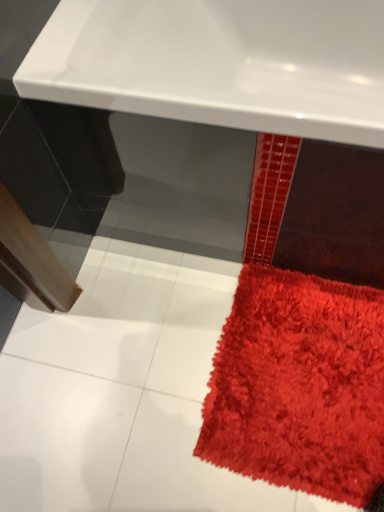
This screenshot has height=512, width=384. What do you see at coordinates (219, 63) in the screenshot? I see `white glossy sink at upper center` at bounding box center [219, 63].

In order to face white glossy sink at upper center, should I rotate leftwards or rightwards?

Rotate right and turn 7.686 degrees.

Where is `white glossy sink at upper center`? The height and width of the screenshot is (512, 384). white glossy sink at upper center is located at coordinates (219, 63).

In order to face shaggy red rug at lower right, should I rotate leftwards or rightwards?

Rotate right and turn 14.698 degrees.

Where is `shaggy red rug at lower right`? Image resolution: width=384 pixels, height=512 pixels. shaggy red rug at lower right is located at coordinates (299, 386).

What do you see at coordinates (299, 386) in the screenshot? I see `shaggy red rug at lower right` at bounding box center [299, 386].

Measure the distance between point (366, 502) and camera.

The depth of point (366, 502) is 36.57 inches.

The image size is (384, 512). I want to click on white glossy sink at upper center, so click(219, 63).

Is white glossy sink at upper center to the left or to the right of shaggy red rug at lower right in the image?

Clearly, white glossy sink at upper center is on the left of shaggy red rug at lower right in the image.

Does white glossy sink at upper center lie behind shaggy red rug at lower right?

No.

Does point (231, 32) lie behind point (227, 340)?

Yes, point (231, 32) is farther from viewer.

From the image's perspective, is white glossy sink at upper center beneath shaggy red rug at lower right?

No.

From a real-world perspective, is white glossy sink at upper center physically located above or below shaggy red rug at lower right?

white glossy sink at upper center is situated higher than shaggy red rug at lower right in the real world.

Considering the sizes of white glossy sink at upper center and shaggy red rug at lower right in the image, is white glossy sink at upper center wider or thinner than shaggy red rug at lower right?

Clearly, white glossy sink at upper center has more width compared to shaggy red rug at lower right.

Considering the relative sizes of white glossy sink at upper center and shaggy red rug at lower right in the image provided, is white glossy sink at upper center taller than shaggy red rug at lower right?

Yes, white glossy sink at upper center is taller than shaggy red rug at lower right.

Who is smaller, white glossy sink at upper center or shaggy red rug at lower right?

With smaller size is shaggy red rug at lower right.

Looking at this image, is shaggy red rug at lower right a part of white glossy sink at upper center?

No, shaggy red rug at lower right is not surrounded by white glossy sink at upper center.

Is white glossy sink at upper center in contact with shaggy red rug at lower right?

white glossy sink at upper center is not next to shaggy red rug at lower right, and they're not touching.

Is white glossy sink at upper center oriented away from shaggy red rug at lower right?

white glossy sink at upper center is not turned away from shaggy red rug at lower right.

How far apart are white glossy sink at upper center and shaggy red rug at lower right?

A distance of 63.16 centimeters exists between white glossy sink at upper center and shaggy red rug at lower right.

At what (x,y) coordinates should I click in order to perform the action: click on mat to the right of white glossy sink at upper center. Please return your answer as a coordinate pair (x, y). Looking at the image, I should click on (299, 386).

Considering the relative positions of shaggy red rug at lower right and white glossy sink at upper center in the image provided, is shaggy red rug at lower right to the left or to the right of white glossy sink at upper center?

Based on their positions, shaggy red rug at lower right is located to the right of white glossy sink at upper center.

Which object is closer to the camera taking this photo, shaggy red rug at lower right or white glossy sink at upper center?

white glossy sink at upper center is closer to the camera.

Which point is more distant from viewer, (306, 440) or (365, 6)?

The point (365, 6) is more distant.

From the image's perspective, is shaggy red rug at lower right positioned above or below white glossy sink at upper center?

From the image's perspective, shaggy red rug at lower right appears below white glossy sink at upper center.

From a real-world perspective, is shaggy red rug at lower right over white glossy sink at upper center?

Incorrect, from a real-world perspective, shaggy red rug at lower right is lower than white glossy sink at upper center.

Considering the sizes of shaggy red rug at lower right and white glossy sink at upper center in the image, is shaggy red rug at lower right wider or thinner than white glossy sink at upper center?

Clearly, shaggy red rug at lower right has less width compared to white glossy sink at upper center.

Which of these two, shaggy red rug at lower right or white glossy sink at upper center, stands taller?

white glossy sink at upper center is taller.

Can you confirm if shaggy red rug at lower right is bigger than white glossy sink at upper center?

Incorrect, shaggy red rug at lower right is not larger than white glossy sink at upper center.

Is shaggy red rug at lower right inside the boundaries of white glossy sink at upper center, or outside?

shaggy red rug at lower right is not enclosed by white glossy sink at upper center.

Is there a large distance between shaggy red rug at lower right and white glossy sink at upper center?

Actually, shaggy red rug at lower right and white glossy sink at upper center are a little close together.

Does shaggy red rug at lower right turn towards white glossy sink at upper center?

No, shaggy red rug at lower right does not turn towards white glossy sink at upper center.

Can you tell me how much shaggy red rug at lower right and white glossy sink at upper center differ in facing direction?

The angle between the facing direction of shaggy red rug at lower right and the facing direction of white glossy sink at upper center is 1.68 degrees.

How much distance is there between shaggy red rug at lower right and white glossy sink at upper center?

The distance of shaggy red rug at lower right from white glossy sink at upper center is 63.16 centimeters.

Image resolution: width=384 pixels, height=512 pixels. Find the location of `mat below the white glossy sink at upper center (from a real-world perspective)`. mat below the white glossy sink at upper center (from a real-world perspective) is located at coordinates (299, 386).

At what (x,y) coordinates should I click in order to perform the action: click on mat behind the white glossy sink at upper center. Please return your answer as a coordinate pair (x, y). Looking at the image, I should click on (299, 386).

I want to click on mat that appears below the white glossy sink at upper center (from a real-world perspective), so click(299, 386).